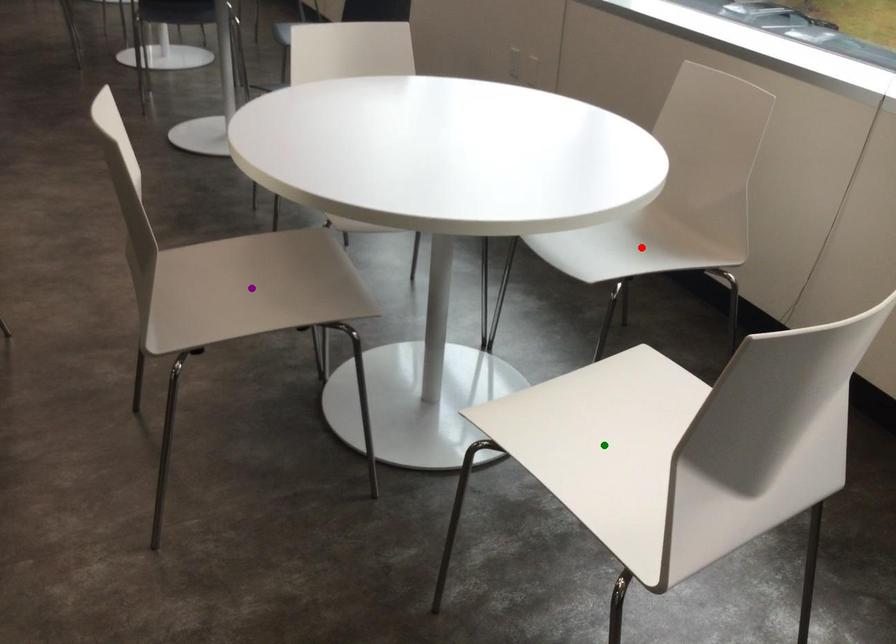
Order these from nearest to farthest:
green point, purple point, red point

green point
purple point
red point